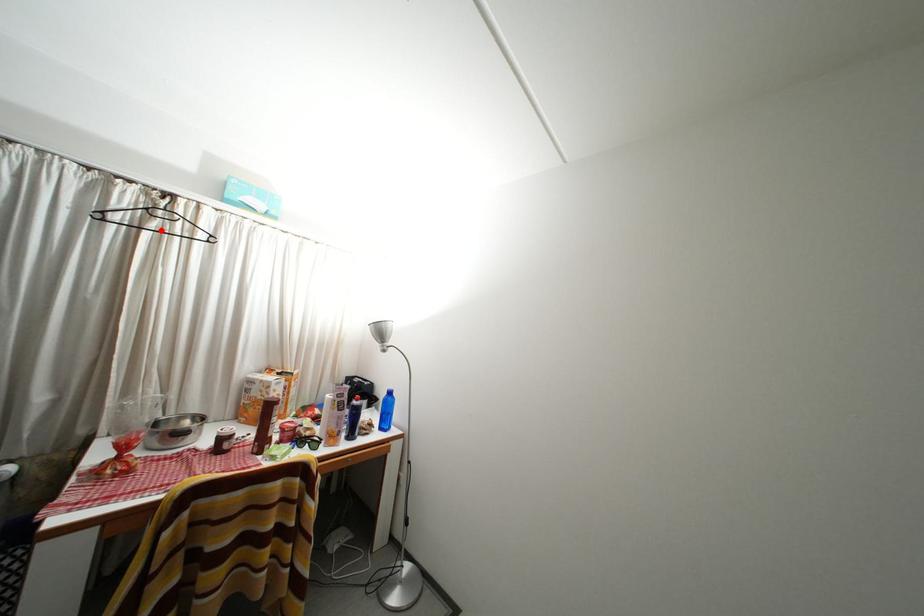
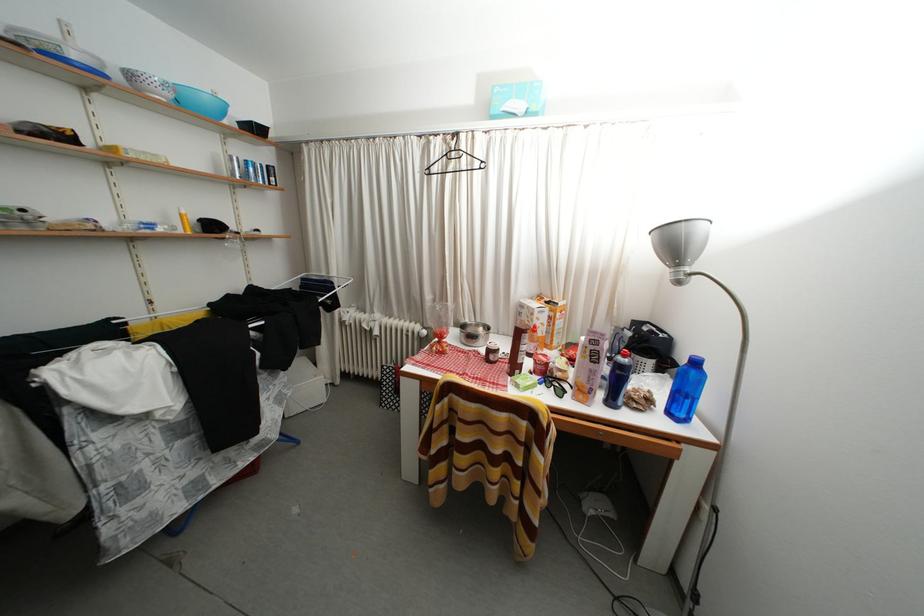
Question: I am providing you with two images of the same scene from different viewpoints. Given a red point in image1, look at the same physical point in image2. Is it:

Choices:
 (A) Closer to the viewpoint
 (B) Farther from the viewpoint

Answer: (A)